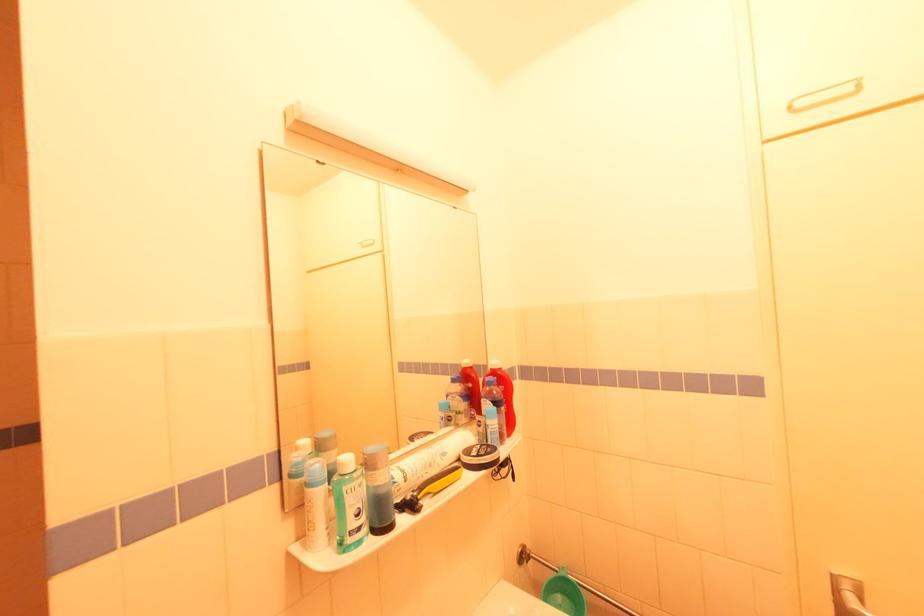
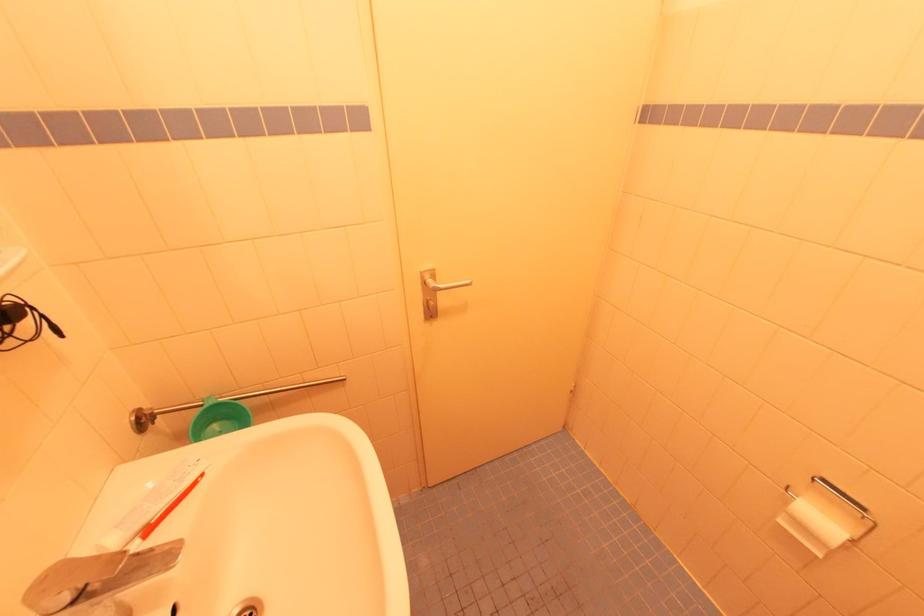
The point at (556, 575) is marked in the first image. Where is the corresponding point in the second image?

(201, 411)